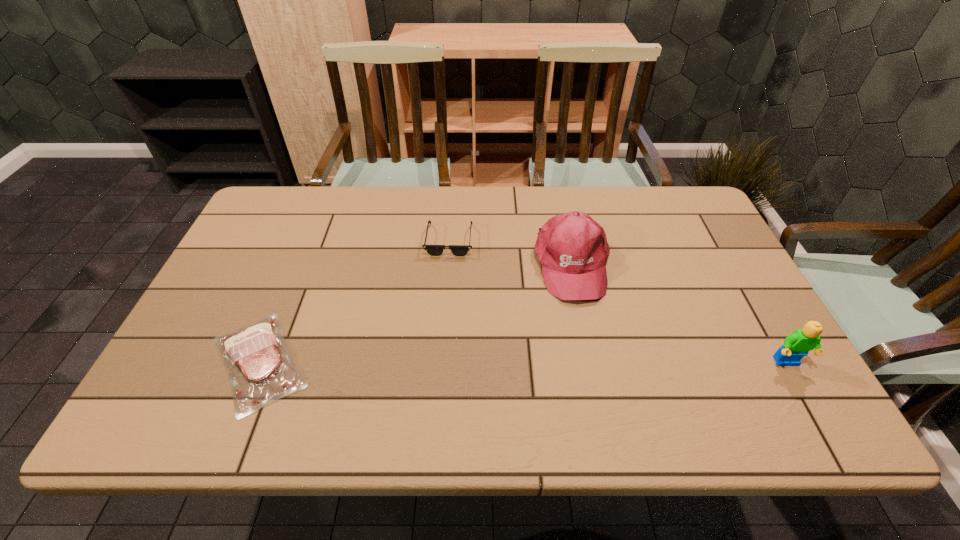
This screenshot has width=960, height=540. In order to click on steak in this screenshot , I will do `click(261, 370)`.

Where is `the shortest object`? This screenshot has width=960, height=540. the shortest object is located at coordinates (261, 370).

I want to click on Lego, so click(x=797, y=345).

In order to click on sunglasses in this screenshot , I will do `click(433, 250)`.

Find the location of a particular element. the third object from right to left is located at coordinates (433, 250).

You are a GUI agent. You are given a task and a screenshot of the screen. Output one action in this format:
    pyautogui.click(x=<x>, y=<y>)
    Task: Click on the second object from right to left
    Image resolution: width=960 pixels, height=540 pixels.
    Given the screenshot: What is the action you would take?
    pyautogui.click(x=572, y=249)

I want to click on free space located 0.130m on the right of the shortest object, so click(372, 362).

Image resolution: width=960 pixels, height=540 pixels. In order to click on free location located on the lenses of the third tallest object in this screenshot , I will do `click(512, 338)`.

Identify the location of vacant space located 0.320m on the lenses of the third tallest object. This screenshot has width=960, height=540. (512, 338).

Identify the location of vacant space located on the lenses of the third tallest object. (483, 293).